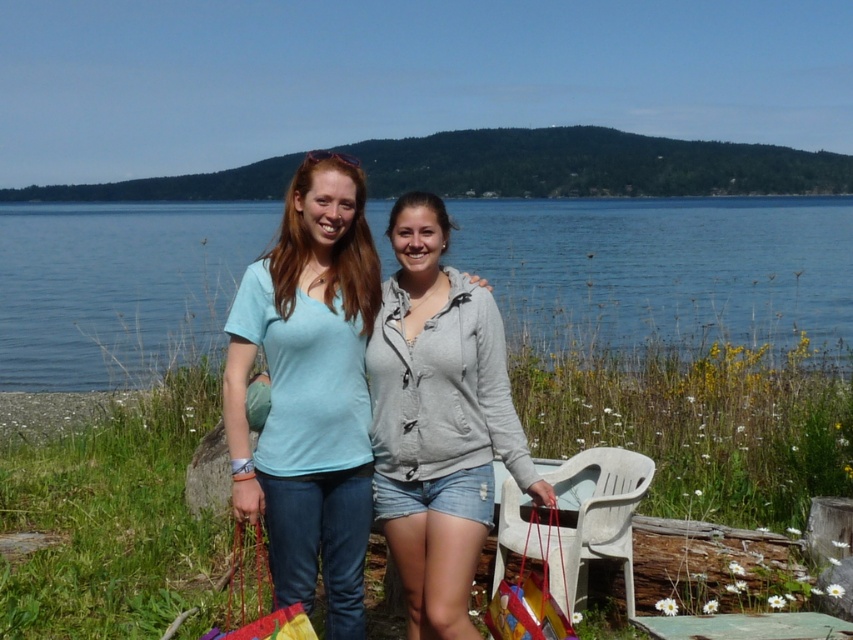
You are planning to place a 10 meter long floating dock between the blue water at center and the green grass at lower center. Will the dock fit the space between them?

The blue water at center and green grass at lower center are 13.31 meters apart, so a 10 meter long floating dock will fit between them since it is shorter than the distance between the two.